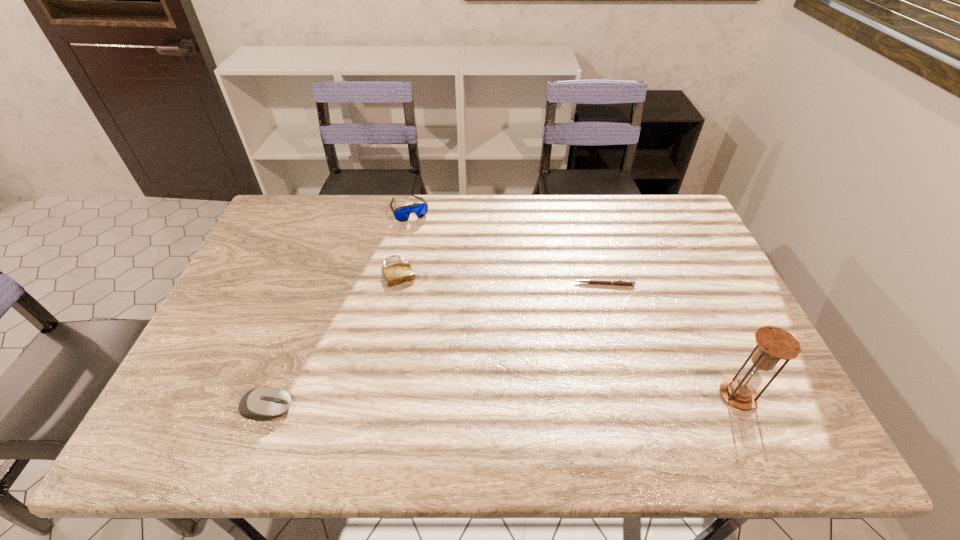
Choose which object is the fourth nearest neighbor to the fourth shortest object. Please provide its 2D coordinates. Your answer should be formatted as a tuple, i.e. [(x, y)], where the tuple contains the x and y coordinates of a point satisfying the conditions above.

[(773, 343)]

Find the location of `vacant position in the image that satisfies the following two spatial constraints: 1. on the front side of the hourglass; 2. on the left side of the second shortest object`. vacant position in the image that satisfies the following two spatial constraints: 1. on the front side of the hourglass; 2. on the left side of the second shortest object is located at coordinates (376, 395).